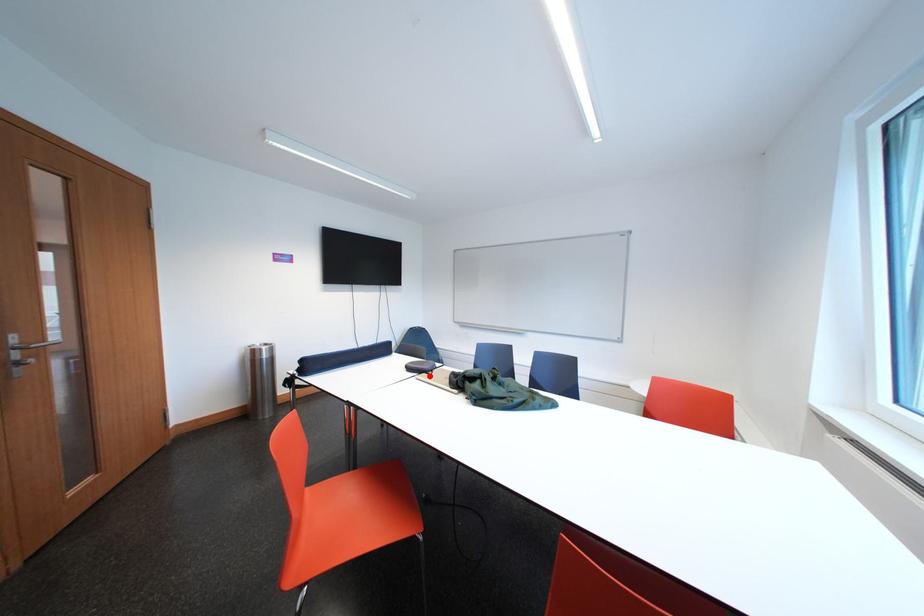
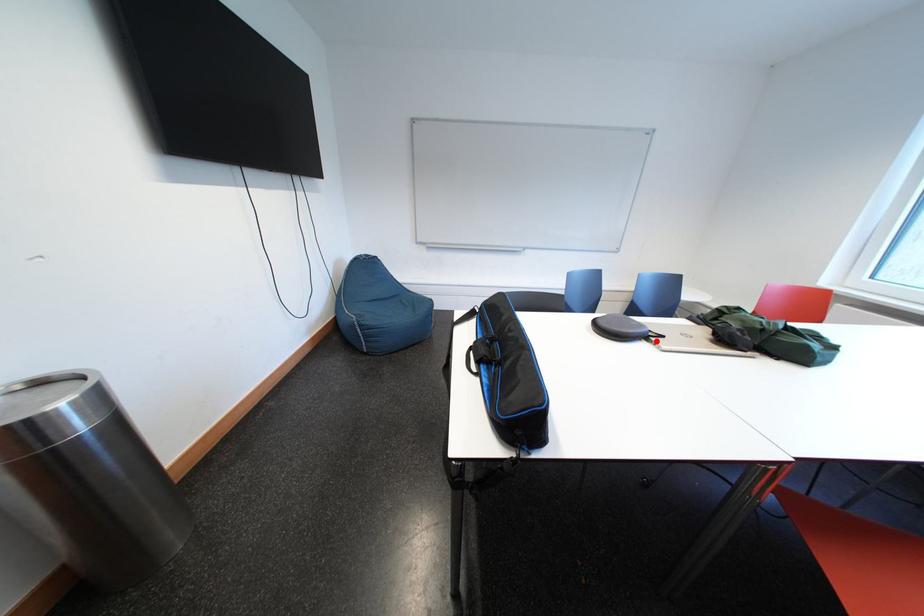
I am providing you with two images of the same scene from different viewpoints. A red point is marked on the first image and another point is marked on the second image. Does the point marked in image1 correspond to the same location as the one in image2?

Yes